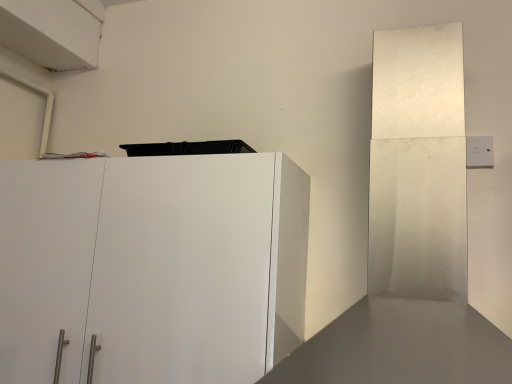
Describe the element at coordinates (152, 267) in the screenshot. I see `white glossy cupboard at center` at that location.

Where is `white glossy cupboard at center`? white glossy cupboard at center is located at coordinates (152, 267).

The image size is (512, 384). I want to click on white glossy cupboard at center, so click(152, 267).